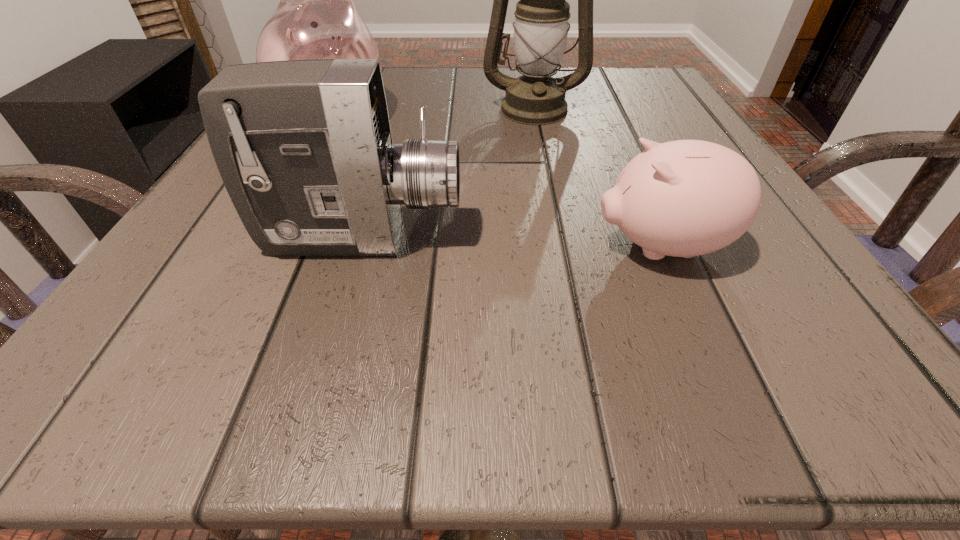
Find the location of a particular element. vacant space that satisfies the following two spatial constraints: 1. on the front facing side of the farther piggy bank; 2. on the left side of the tallest object is located at coordinates (340, 108).

Image resolution: width=960 pixels, height=540 pixels. Identify the location of vacant region that satisfies the following two spatial constraints: 1. on the front facing side of the tallest object; 2. on the right side of the left piggy bank. (340, 108).

Locate an element on the screen. The height and width of the screenshot is (540, 960). blank area in the image that satisfies the following two spatial constraints: 1. on the front facing side of the oil lamp; 2. on the right side of the farther piggy bank is located at coordinates (340, 108).

What are the coordinates of `free space that satisfies the following two spatial constraints: 1. on the front facing side of the left piggy bank; 2. on the left side of the oil lamp` in the screenshot? It's located at (340, 108).